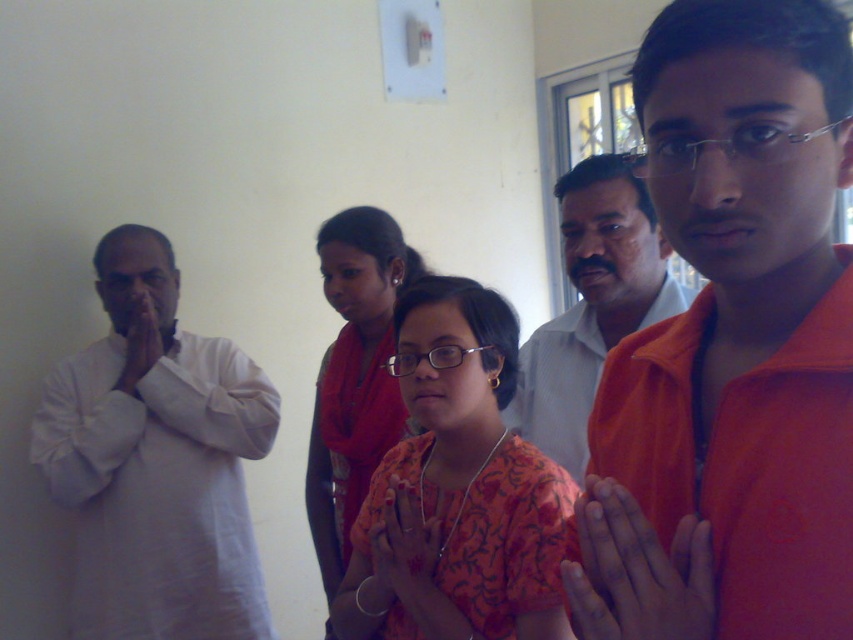
Question: Is orange printed dress at center smaller than orange printed sari at center?

Choices:
 (A) yes
 (B) no

Answer: (A)

Question: Among these objects, which one is farthest from the camera?

Choices:
 (A) orange printed sari at center
 (B) white cotton kurta at left

Answer: (B)

Question: Observing the image, what is the correct spatial positioning of orange cotton shirt at center in reference to white cotton kurta at left?

Choices:
 (A) below
 (B) above

Answer: (B)

Question: Which object is the closest to the orange cotton shirt at center?

Choices:
 (A) orange printed sari at center
 (B) white cotton kurta at left

Answer: (A)

Question: Which point is closer to the camera taking this photo?

Choices:
 (A) (527, 419)
 (B) (131, 368)
 (C) (351, 442)

Answer: (A)

Question: Can you confirm if orange cotton shirt at center is thinner than matte white shirt at center?

Choices:
 (A) yes
 (B) no

Answer: (A)